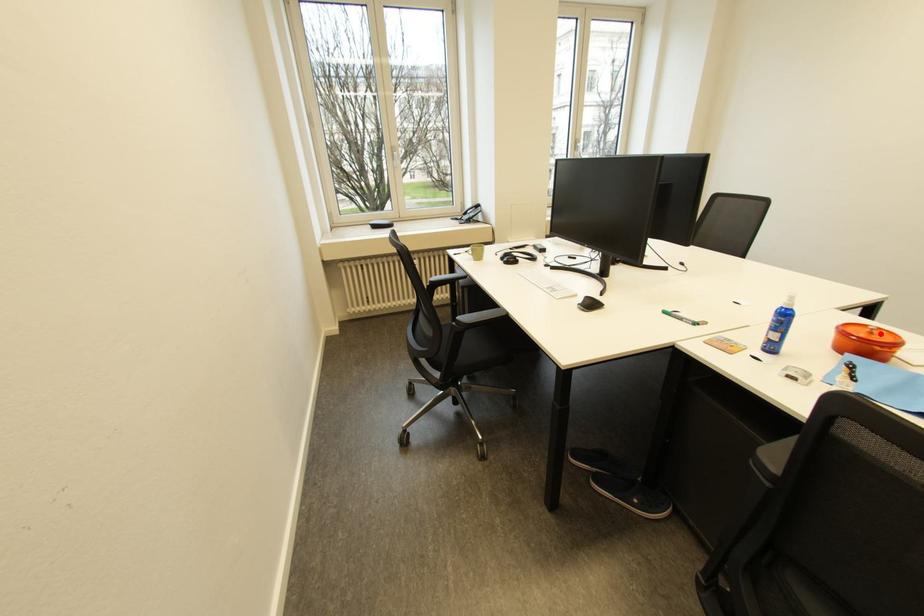
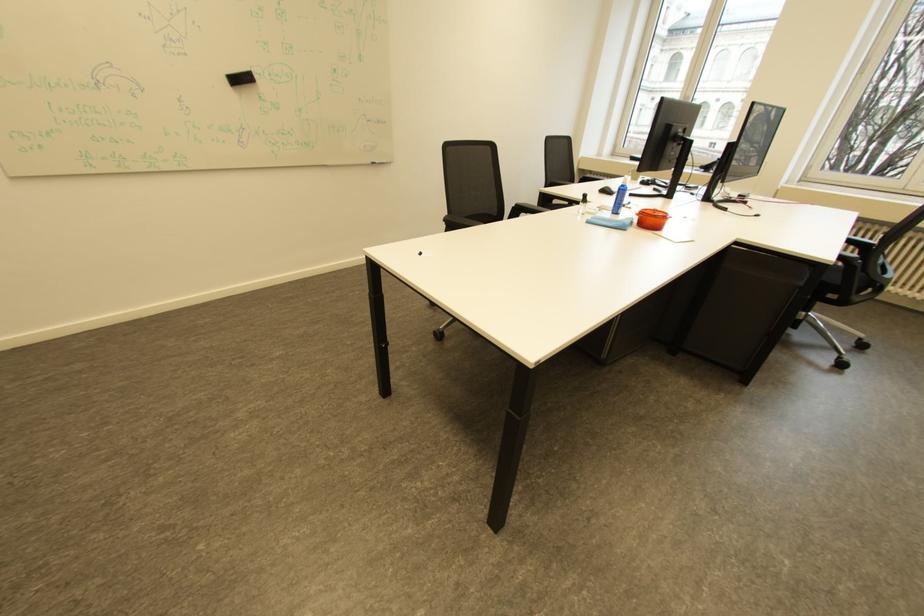
Question: I am providing you with two images of the same scene from different viewpoints. A red point is marked on the first image. Can you still see the location of the red point in image 2?

Choices:
 (A) Yes
 (B) No

Answer: (A)